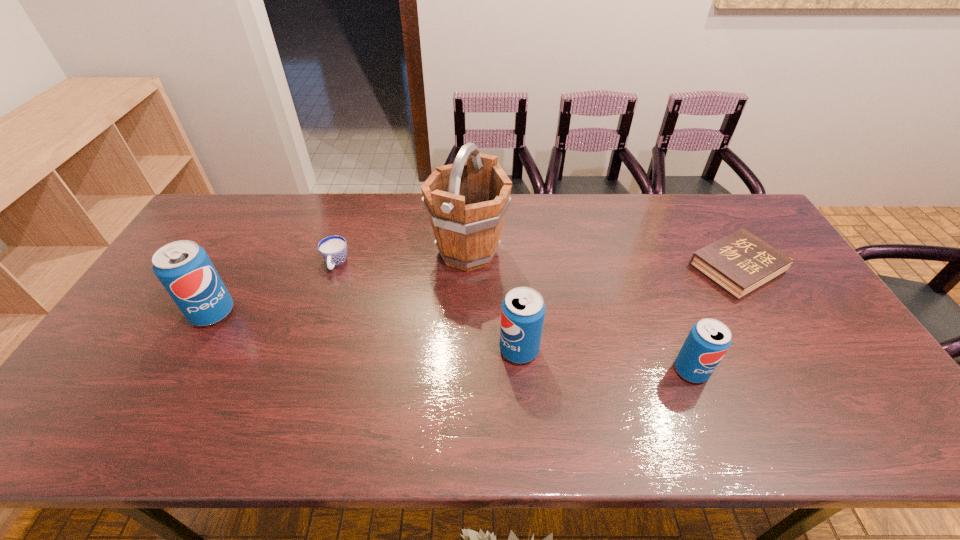
Image resolution: width=960 pixels, height=540 pixels. I want to click on free point between the farthest soda can and the rightmost object, so click(x=475, y=291).

Locate an element on the screen. The height and width of the screenshot is (540, 960). free space between the second tallest soda can and the tallest object is located at coordinates (493, 301).

At what (x,y) coordinates should I click in order to perform the action: click on free space between the leftmost soda can and the fifth tallest object. Please return your answer as a coordinate pair (x, y). Looking at the image, I should click on (275, 288).

Locate an element on the screen. The height and width of the screenshot is (540, 960). free space between the bucket and the farthest soda can is located at coordinates (340, 282).

Find the location of a particular element. unoccupied position between the tallest object and the farthest soda can is located at coordinates (340, 282).

At what (x,y) coordinates should I click in order to perform the action: click on empty space between the rightmost object and the tallest object. Please return your answer as a coordinate pair (x, y). Looking at the image, I should click on (603, 260).

Find the location of a particular element. This screenshot has height=540, width=960. object that stands as the fifth closest to the second shortest object is located at coordinates (739, 263).

Find the location of a particular element. This screenshot has width=960, height=540. the fifth closest object to the second soda can from right to left is located at coordinates (183, 267).

The image size is (960, 540). What are the coordinates of `soda can that stands as the closest to the cup` in the screenshot? It's located at (183, 267).

Where is `soda can that is the closest to the fourth shortest object`? This screenshot has width=960, height=540. soda can that is the closest to the fourth shortest object is located at coordinates (709, 339).